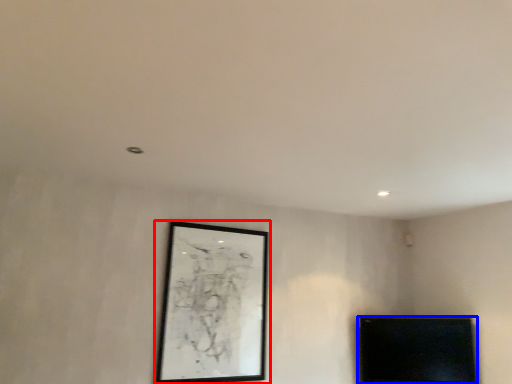
Question: Which object appears farthest to the camera in this image, picture frame (highlighted by a red box) or furniture (highlighted by a blue box)?

Choices:
 (A) picture frame
 (B) furniture

Answer: (B)